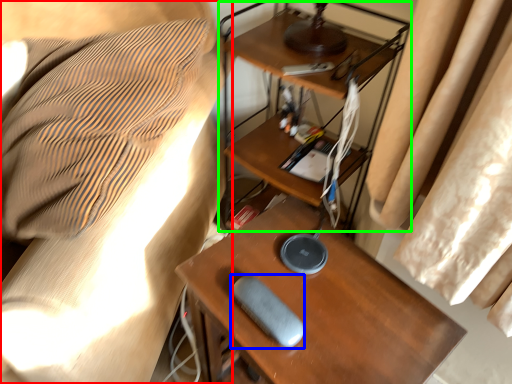
Question: Which is farther away from furniture (highlighted by a red box)? equipment (highlighted by a blue box) or computer desk (highlighted by a green box)?

Choices:
 (A) equipment
 (B) computer desk

Answer: (A)